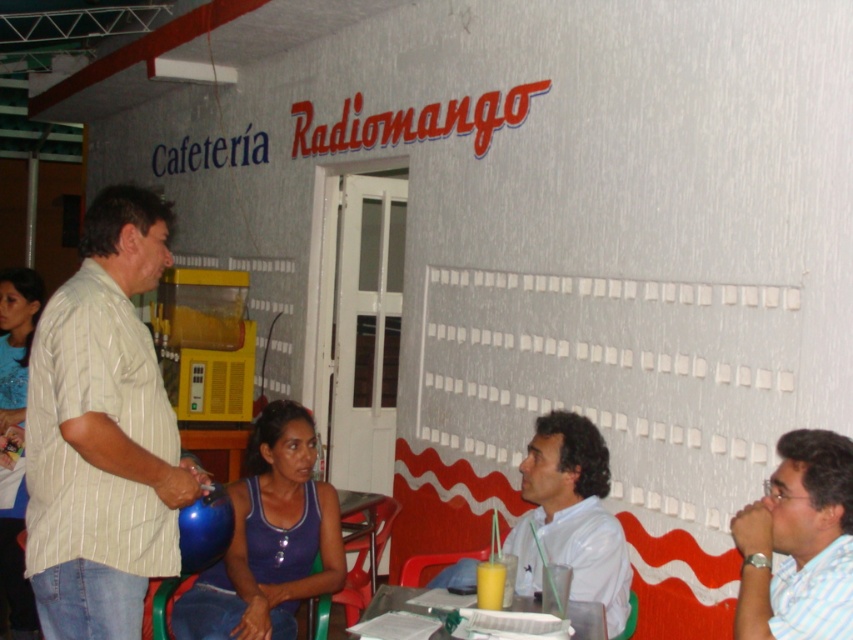
Does striped cotton shirt at left appear under translucent plastic table at lower center?

Incorrect, striped cotton shirt at left is not positioned below translucent plastic table at lower center.

Is striped cotton shirt at left closer to the viewer compared to translucent plastic table at lower center?

Yes, it is in front of translucent plastic table at lower center.

What do you see at coordinates (103, 433) in the screenshot?
I see `striped cotton shirt at left` at bounding box center [103, 433].

I want to click on striped cotton shirt at left, so click(103, 433).

Describe the element at coordinates (103, 433) in the screenshot. I see `striped cotton shirt at left` at that location.

Which is in front, point (97, 346) or point (323, 499)?

Positioned in front is point (97, 346).

Locate an element on the screen. This screenshot has height=640, width=853. striped cotton shirt at left is located at coordinates (103, 433).

This screenshot has width=853, height=640. What are the coordinates of `striped cotton shirt at left` in the screenshot? It's located at (103, 433).

Is blue fabric tank top at center taller than white glossy shirt at center?

Indeed, blue fabric tank top at center has a greater height compared to white glossy shirt at center.

Measure the distance between blue fabric tank top at center and white glossy shirt at center.

blue fabric tank top at center and white glossy shirt at center are 30.48 inches apart from each other.

Is point (227, 612) less distant than point (621, 547)?

No, (227, 612) is behind (621, 547).

Locate an element on the screen. The height and width of the screenshot is (640, 853). blue fabric tank top at center is located at coordinates (270, 538).